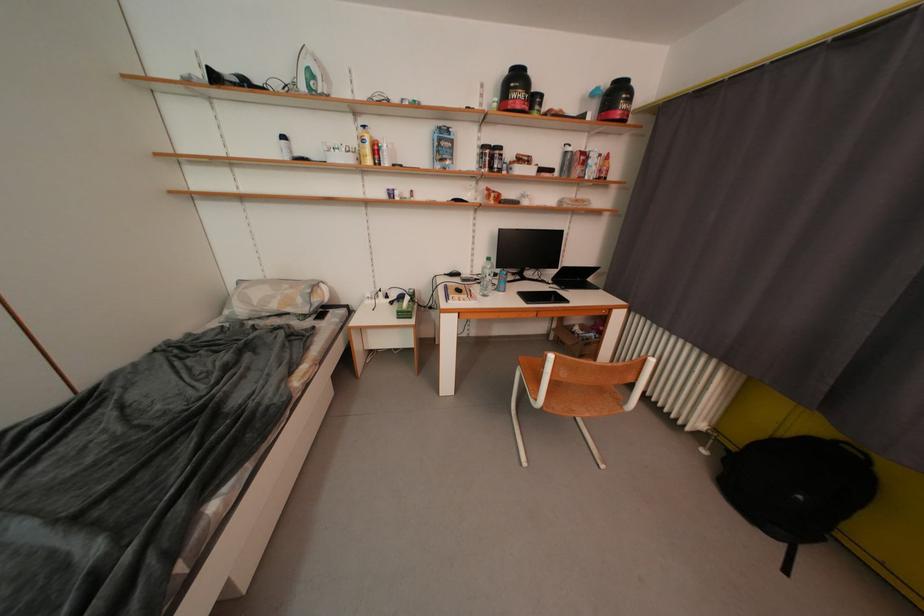
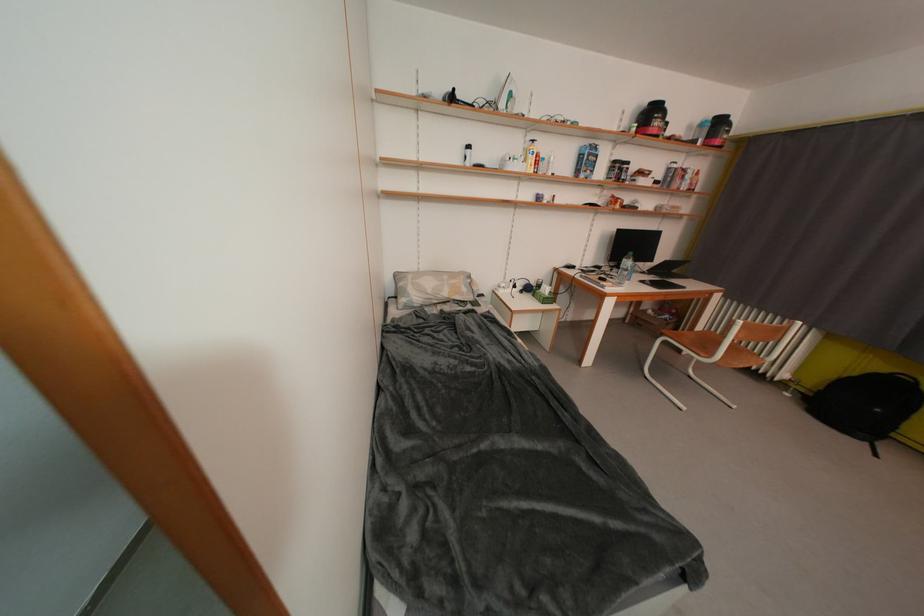
In the second image, find the point that corresponds to (x=307, y=304) in the first image.

(471, 293)